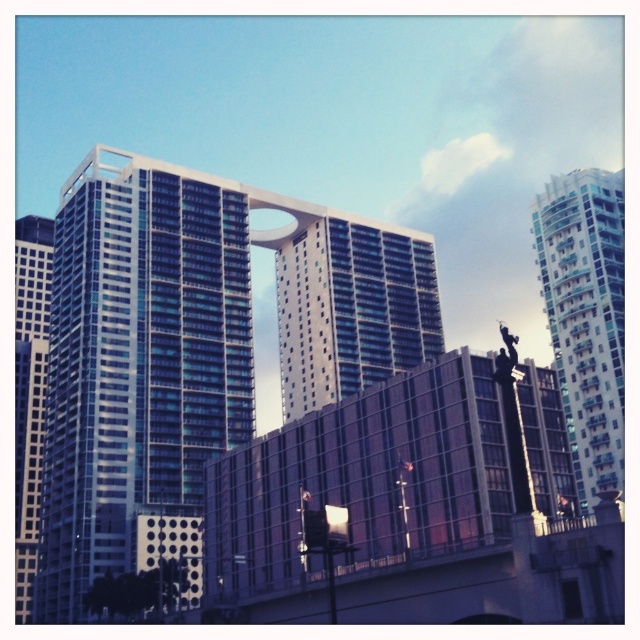
Does white glass building at right lie in front of glassy blue skyscraper at left?

That is True.

Find the location of a particular element. This screenshot has height=640, width=640. white glass building at right is located at coordinates (586, 317).

The height and width of the screenshot is (640, 640). Identify the location of white glass building at right. 586,317.

Can you confirm if glassy blue skyscraper at center is bigger than white glass building at right?

Indeed, glassy blue skyscraper at center has a larger size compared to white glass building at right.

Is glassy blue skyscraper at center below white glass building at right?

Actually, glassy blue skyscraper at center is above white glass building at right.

The image size is (640, 640). In order to click on glassy blue skyscraper at center in this screenshot , I will do `click(196, 344)`.

Which of these two, glassy blue skyscraper at center or glassy blue skyscraper at left, stands taller?

glassy blue skyscraper at left

Is glassy blue skyscraper at center closer to camera compared to glassy blue skyscraper at left?

Yes, glassy blue skyscraper at center is in front of glassy blue skyscraper at left.

Where is `glassy blue skyscraper at center`? glassy blue skyscraper at center is located at coordinates (196, 344).

Locate an element on the screen. The image size is (640, 640). glassy blue skyscraper at center is located at coordinates (196, 344).